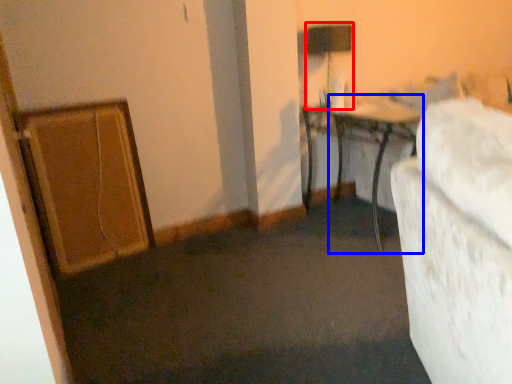
Question: Which object is closer to the camera taking this photo, table lamp (highlighted by a red box) or table (highlighted by a blue box)?

Choices:
 (A) table lamp
 (B) table

Answer: (B)